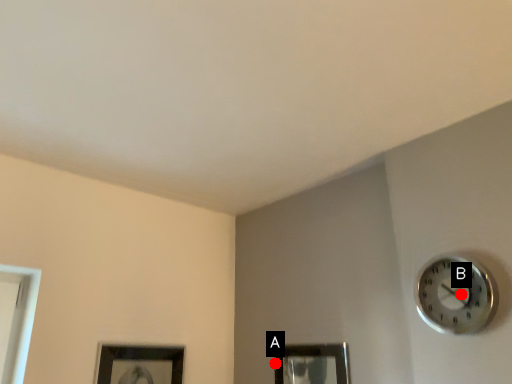
Question: Two points are circled on the image, labeled by A and B beside each circle. Which of the following is the farthest from the observer?

Choices:
 (A) A is further
 (B) B is further

Answer: (A)